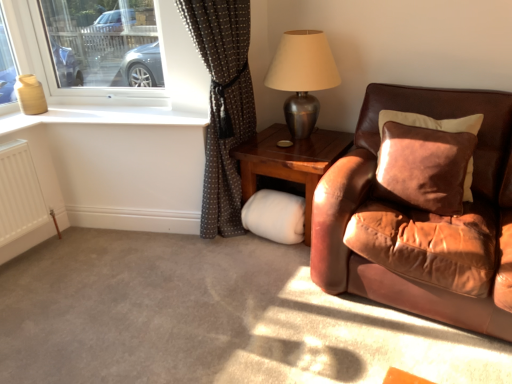
The width and height of the screenshot is (512, 384). Find the location of `free space in front of white matte radiator at lower left`. free space in front of white matte radiator at lower left is located at coordinates (29, 284).